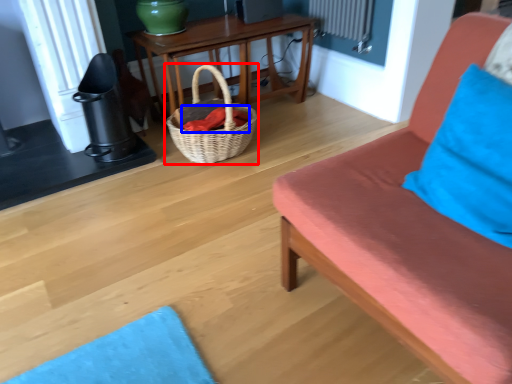
Question: Among these objects, which one is farthest to the camera, picnic basket (highlighted by a red box) or material (highlighted by a blue box)?

Choices:
 (A) picnic basket
 (B) material

Answer: (B)